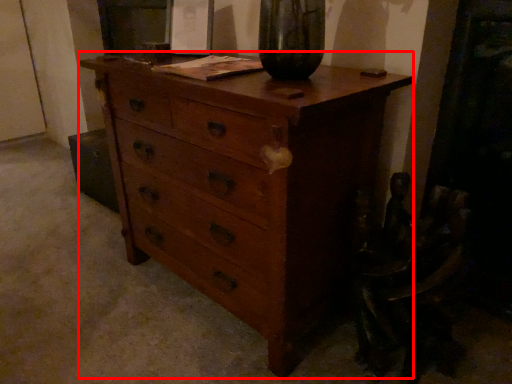
Question: From the image's perspective, where is chest of drawers (annotated by the red box) located in relation to swivel chair in the image?

Choices:
 (A) above
 (B) below

Answer: (A)